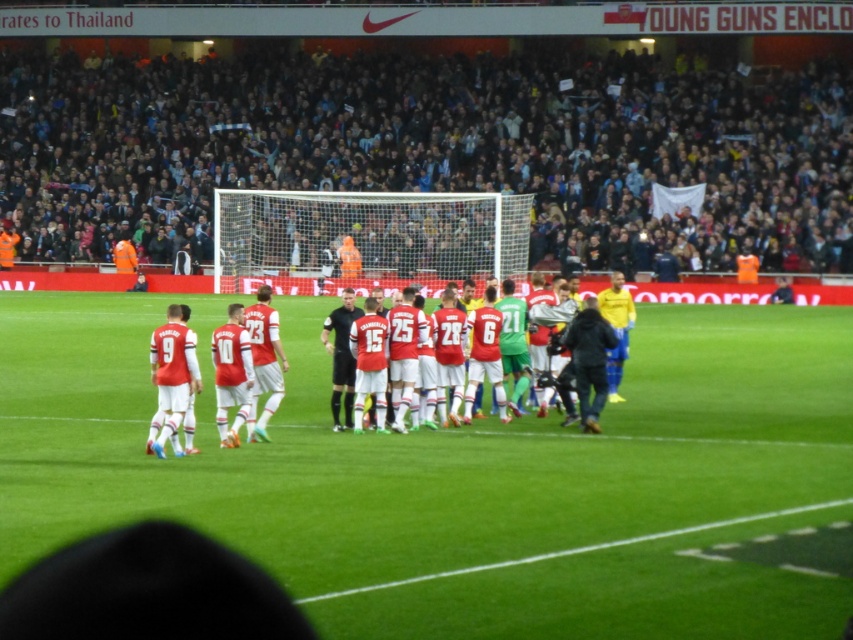
Question: Can you confirm if green grass field at center is wider than yellow matte jersey at right?

Choices:
 (A) yes
 (B) no

Answer: (A)

Question: Is red matte jersey at center to the left of red jersey soccer player at center from the viewer's perspective?

Choices:
 (A) no
 (B) yes

Answer: (B)

Question: Does red jersey soccer player at center lie in front of yellow matte jersey at right?

Choices:
 (A) no
 (B) yes

Answer: (B)

Question: Which object appears farthest from the camera in this image?

Choices:
 (A) yellow matte jersey at right
 (B) green grass field at center
 (C) green grass at center
 (D) red matte jersey at center

Answer: (A)

Question: Which point is closer to the camera?

Choices:
 (A) black jersey at center
 (B) green grass field at center
 (C) dark gray crowd at upper center
 (D) red matte jersey at center

Answer: (B)

Question: Which point is farther to the camera?

Choices:
 (A) yellow matte jersey at right
 (B) red matte jersey at center
 (C) red jersey soccer player at center
 (D) green grass field at center

Answer: (A)